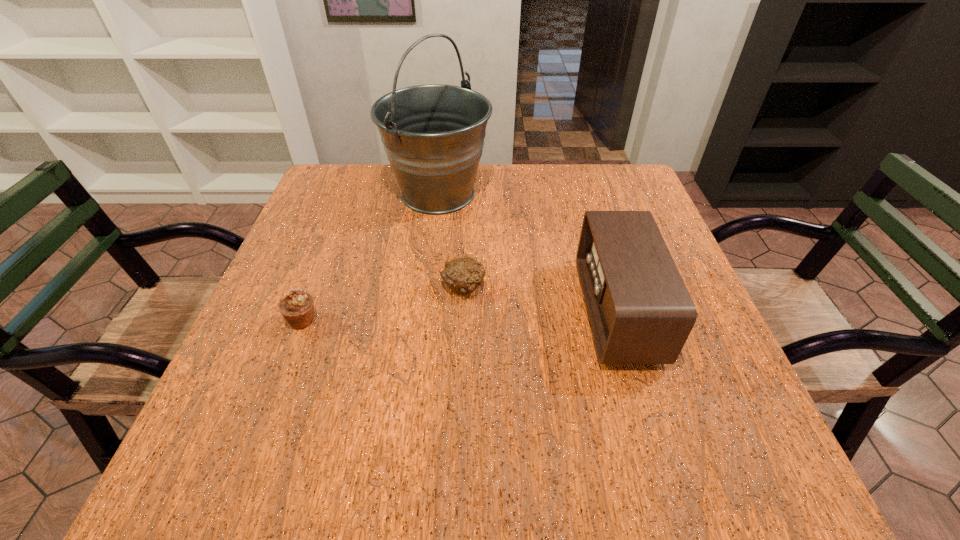
Find the location of a particular element. the tallest object is located at coordinates 433,134.

This screenshot has height=540, width=960. Find the location of `bucket`. bucket is located at coordinates (433, 134).

Where is `the rightmost object`? the rightmost object is located at coordinates (640, 311).

The width and height of the screenshot is (960, 540). In order to click on the third shortest object in this screenshot , I will do `click(640, 311)`.

In order to click on the left muffin in this screenshot , I will do tap(297, 307).

Locate an element on the screen. This screenshot has width=960, height=540. the second shortest object is located at coordinates (297, 307).

At what (x,y) coordinates should I click in order to perform the action: click on the shortest object. Please return your answer as a coordinate pair (x, y). The image size is (960, 540). Looking at the image, I should click on (463, 275).

This screenshot has height=540, width=960. In order to click on the farther muffin in this screenshot , I will do `click(463, 275)`.

Where is `blank space located 0.340m on the right of the bucket`? This screenshot has width=960, height=540. blank space located 0.340m on the right of the bucket is located at coordinates (615, 194).

At what (x,y) coordinates should I click in order to perform the action: click on vacant region located 0.180m on the front-facing side of the rightmost object. Please return your answer as a coordinate pair (x, y). Image resolution: width=960 pixels, height=540 pixels. Looking at the image, I should click on (496, 312).